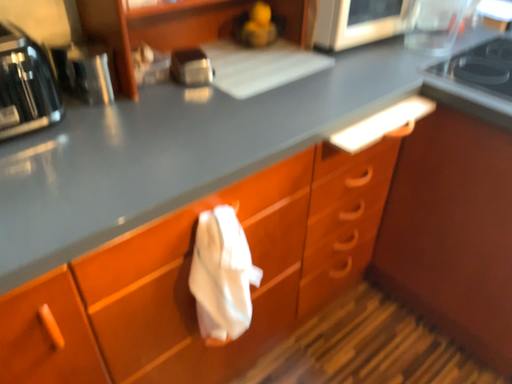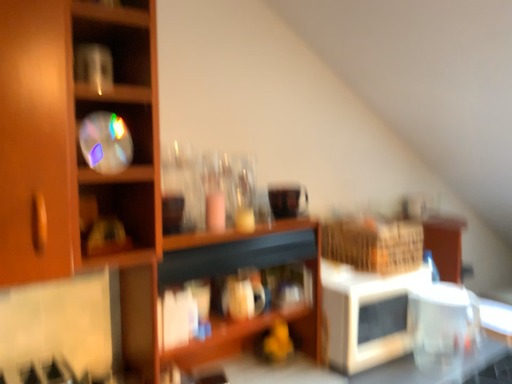
Question: Which way did the camera rotate in the video?

Choices:
 (A) rotated upward
 (B) rotated downward

Answer: (A)